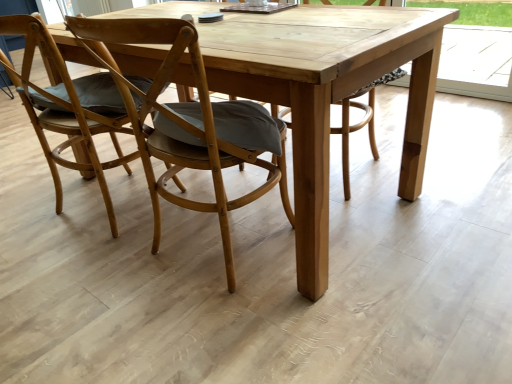
Measure the distance between wooden chair with cushion at center, which is the 1th chair in right-to-left order, and camera.

38.23 inches.

Identify the location of wooden chair at left, positioned as the 1th chair in left-to-right order. The height and width of the screenshot is (384, 512). (65, 111).

Looking at the image, does wooden chair at left, marked as the 2th chair in a right-to-left arrangement, seem bigger or smaller compared to natural wood picnic table at center?

wooden chair at left, marked as the 2th chair in a right-to-left arrangement, is smaller than natural wood picnic table at center.

From a real-world perspective, does wooden chair at left, marked as the 2th chair in a right-to-left arrangement, sit lower than natural wood picnic table at center?

Incorrect, from a real-world perspective, wooden chair at left, marked as the 2th chair in a right-to-left arrangement, is higher than natural wood picnic table at center.

How many degrees apart are the facing directions of wooden chair at left, marked as the 2th chair in a right-to-left arrangement, and natural wood picnic table at center?

1.64 degrees.

Is wooden chair at left, marked as the 2th chair in a right-to-left arrangement, with natural wood picnic table at center?

No.

In the scene shown: Does natural wood picnic table at center have a greater height compared to wooden chair with cushion at center, which is the 1th chair in right-to-left order?

Incorrect, the height of natural wood picnic table at center is not larger of that of wooden chair with cushion at center, which is the 1th chair in right-to-left order.

From the picture: Considering the positions of objects natural wood picnic table at center and wooden chair with cushion at center, which is the 2th chair from left to right, in the image provided, who is in front, natural wood picnic table at center or wooden chair with cushion at center, which is the 2th chair from left to right,?

Positioned in front is wooden chair with cushion at center, which is the 2th chair from left to right.

Is point (194, 15) positioned before point (160, 121)?

That is False.

You are a GUI agent. You are given a task and a screenshot of the screen. Output one action in this format:
    pyautogui.click(x=<x>, y=<y>)
    Task: Click on the 2nd chair directly above the natural wood picnic table at center (from a real-world perspective)
    
    Given the screenshot: What is the action you would take?
    point(185,122)

Would you say wooden chair with cushion at center, which is the 2th chair from left to right, contains wooden chair at left, marked as the 2th chair in a right-to-left arrangement?

That's incorrect, wooden chair at left, marked as the 2th chair in a right-to-left arrangement, is not inside wooden chair with cushion at center, which is the 2th chair from left to right.

From the image's perspective, which one is positioned higher, wooden chair with cushion at center, which is the 2th chair from left to right, or wooden chair at left, positioned as the 1th chair in left-to-right order?

wooden chair at left, positioned as the 1th chair in left-to-right order.

From a real-world perspective, is wooden chair with cushion at center, which is the 1th chair in right-to-left order, under wooden chair at left, positioned as the 1th chair in left-to-right order?

No, from a real-world perspective, wooden chair with cushion at center, which is the 1th chair in right-to-left order, is not beneath wooden chair at left, positioned as the 1th chair in left-to-right order.

Is wooden chair with cushion at center, which is the 2th chair from left to right, closer to camera compared to wooden chair at left, marked as the 2th chair in a right-to-left arrangement?

Yes, wooden chair with cushion at center, which is the 2th chair from left to right, is closer to the camera.

Between natural wood picnic table at center and wooden chair at left, marked as the 2th chair in a right-to-left arrangement, which one appears on the left side from the viewer's perspective?

From the viewer's perspective, wooden chair at left, marked as the 2th chair in a right-to-left arrangement, appears more on the left side.

Based on the photo, is natural wood picnic table at center wider or thinner than wooden chair at left, positioned as the 1th chair in left-to-right order?

Considering their sizes, natural wood picnic table at center looks broader than wooden chair at left, positioned as the 1th chair in left-to-right order.

How many degrees apart are the facing directions of natural wood picnic table at center and wooden chair at left, positioned as the 1th chair in left-to-right order?

The angle between the facing direction of natural wood picnic table at center and the facing direction of wooden chair at left, positioned as the 1th chair in left-to-right order, is 1.64 degrees.

Considering the sizes of objects wooden chair with cushion at center, which is the 1th chair in right-to-left order, and natural wood picnic table at center in the image provided, who is smaller, wooden chair with cushion at center, which is the 1th chair in right-to-left order, or natural wood picnic table at center?

With smaller size is wooden chair with cushion at center, which is the 1th chair in right-to-left order.

From a real-world perspective, which is physically below, wooden chair with cushion at center, which is the 1th chair in right-to-left order, or natural wood picnic table at center?

From a 3D spatial view, natural wood picnic table at center is below.

The image size is (512, 384). Find the location of `picnic table on the right of wooden chair with cushion at center, which is the 1th chair in right-to-left order`. picnic table on the right of wooden chair with cushion at center, which is the 1th chair in right-to-left order is located at coordinates (327, 93).

Considering the positions of objects wooden chair with cushion at center, which is the 2th chair from left to right, and natural wood picnic table at center in the image provided, who is more to the right, wooden chair with cushion at center, which is the 2th chair from left to right, or natural wood picnic table at center?

From the viewer's perspective, natural wood picnic table at center appears more on the right side.

Can wooden chair with cushion at center, which is the 1th chair in right-to-left order, be found inside wooden chair at left, positioned as the 1th chair in left-to-right order?

No, wooden chair with cushion at center, which is the 1th chair in right-to-left order, is not inside wooden chair at left, positioned as the 1th chair in left-to-right order.

Is wooden chair at left, marked as the 2th chair in a right-to-left arrangement, not near wooden chair with cushion at center, which is the 1th chair in right-to-left order?

No, wooden chair at left, marked as the 2th chair in a right-to-left arrangement, is not far from wooden chair with cushion at center, which is the 1th chair in right-to-left order.

Find the location of a particular element. This screenshot has height=384, width=512. chair that appears below the wooden chair at left, positioned as the 1th chair in left-to-right order (from the image's perspective) is located at coordinates (185, 122).

In terms of size, does wooden chair at left, marked as the 2th chair in a right-to-left arrangement, appear bigger or smaller than wooden chair with cushion at center, which is the 2th chair from left to right?

Considering their sizes, wooden chair at left, marked as the 2th chair in a right-to-left arrangement, takes up more space than wooden chair with cushion at center, which is the 2th chair from left to right.

You are a GUI agent. You are given a task and a screenshot of the screen. Output one action in this format:
    pyautogui.click(x=<x>, y=<y>)
    Task: Click on the picnic table directly beneath the wooden chair at left, positioned as the 1th chair in left-to-right order (from a real-world perspective)
    
    Given the screenshot: What is the action you would take?
    pyautogui.click(x=327, y=93)

What are the coordinates of `chair in front of the natural wood picnic table at center` in the screenshot? It's located at (185, 122).

Which object lies nearer to the anchor point wooden chair with cushion at center, which is the 1th chair in right-to-left order, wooden chair at left, positioned as the 1th chair in left-to-right order, or natural wood picnic table at center?

→ natural wood picnic table at center is closer to wooden chair with cushion at center, which is the 1th chair in right-to-left order.

Which object lies nearer to the anchor point natural wood picnic table at center, wooden chair at left, positioned as the 1th chair in left-to-right order, or wooden chair with cushion at center, which is the 1th chair in right-to-left order?

The object closer to natural wood picnic table at center is wooden chair with cushion at center, which is the 1th chair in right-to-left order.

Based on their spatial positions, is wooden chair with cushion at center, which is the 1th chair in right-to-left order, or wooden chair at left, positioned as the 1th chair in left-to-right order, closer to natural wood picnic table at center?

wooden chair with cushion at center, which is the 1th chair in right-to-left order.

Considering their positions, is natural wood picnic table at center positioned closer to wooden chair at left, marked as the 2th chair in a right-to-left arrangement, than wooden chair with cushion at center, which is the 1th chair in right-to-left order?

The object closer to wooden chair at left, marked as the 2th chair in a right-to-left arrangement, is wooden chair with cushion at center, which is the 1th chair in right-to-left order.

Considering their positions, is wooden chair with cushion at center, which is the 1th chair in right-to-left order, positioned further to wooden chair at left, positioned as the 1th chair in left-to-right order, than natural wood picnic table at center?

natural wood picnic table at center lies further to wooden chair at left, positioned as the 1th chair in left-to-right order, than the other object.

From the image, which object appears to be farther from wooden chair with cushion at center, which is the 1th chair in right-to-left order, natural wood picnic table at center or wooden chair at left, marked as the 2th chair in a right-to-left arrangement?

Based on the image, wooden chair at left, marked as the 2th chair in a right-to-left arrangement, appears to be further to wooden chair with cushion at center, which is the 1th chair in right-to-left order.

The width and height of the screenshot is (512, 384). Identify the location of chair between wooden chair at left, positioned as the 1th chair in left-to-right order, and natural wood picnic table at center. (185, 122).